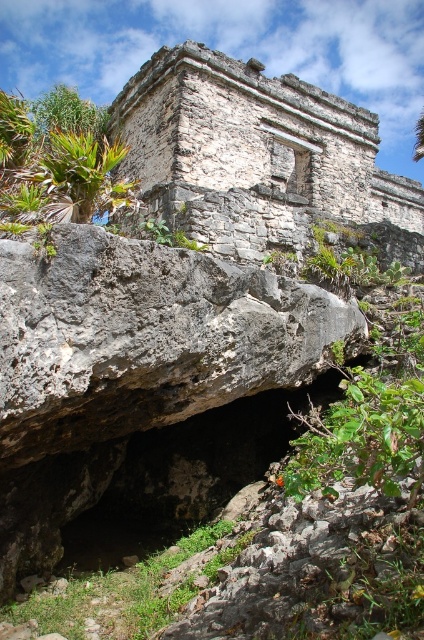
Question: Which point is farther to the camera?

Choices:
 (A) (78, 147)
 (B) (412, 188)

Answer: (B)

Question: Is weathered stone ruins at upper center above green leafy palm tree at upper left?

Choices:
 (A) yes
 (B) no

Answer: (A)

Question: Which point appears farthest from the camera in this image?

Choices:
 (A) (267, 168)
 (B) (116, 204)

Answer: (A)

Question: Observing the image, what is the correct spatial positioning of weathered stone ruins at upper center in reference to green leafy palm tree at upper left?

Choices:
 (A) left
 (B) right

Answer: (B)

Question: Is weathered stone ruins at upper center smaller than green leafy palm tree at upper left?

Choices:
 (A) yes
 (B) no

Answer: (B)